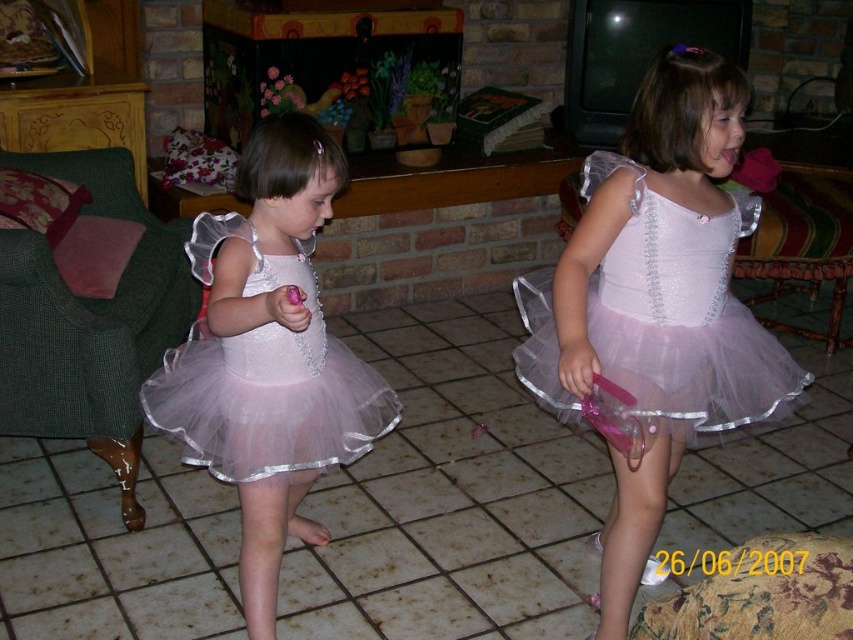
You are a photographer setting up for a photoshoot in this living room. You need to position a backdrop behind the pink tulle dress at left and the pink tulle ballet skirt at center. Since the backdrop stand can only hold items up to 1.2 meters tall, will the tallest object among them fit under this height?

The pink tulle dress at left is taller than the pink tulle ballet skirt at center. If the backdrop stand can only hold items up to 1.2 meters tall, then the tallest object, which is the pink tulle dress at left, must be under 1.2 meters to fit. However, the description does not provide specific height measurements for either object. Therefore, it is impossible to determine if they will fit based on the given information.

You are a photographer setting up for a photoshoot in the living room. You need to position a light source so that it illuminates both the pink tulle dress at center and the pink tulle ballet skirt at center without casting shadows on either. Given their positions, where should you place the light source relative to the two items?

The pink tulle dress at center is located below the pink tulle ballet skirt at center. To avoid casting shadows on either, the light source should be placed above both items, ensuring that light falls evenly on both the upper and lower positions.

You are a photographer setting up for a photoshoot in the living room. You need to position the pink tulle dress at center and the pink tulle ballet skirt at center so that they are aligned properly. According to the scene, which one should be placed to the right side?

The pink tulle dress at center should be placed to the right of the pink tulle ballet skirt at center as per the description.